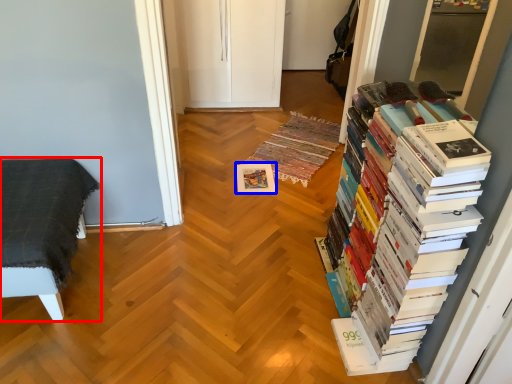
Question: Which object appears farthest to the camera in this image, furniture (highlighted by a red box) or paperback book (highlighted by a blue box)?

Choices:
 (A) furniture
 (B) paperback book

Answer: (B)